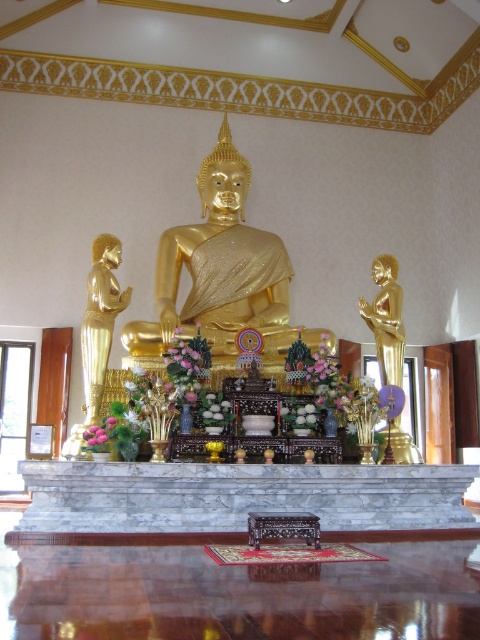
Question: Which of the following is the closest to the observer?

Choices:
 (A) gold polished statue at left
 (B) gold shiny statue at center

Answer: (A)

Question: Can you confirm if gold polished statue at left is positioned to the left of gold polished statue at right?

Choices:
 (A) no
 (B) yes

Answer: (B)

Question: Which object is farther from the camera taking this photo?

Choices:
 (A) gold polished statue at left
 (B) gold shiny statue at center
 (C) gold polished statue at right

Answer: (B)

Question: Can you confirm if gold polished statue at left is wider than gold polished statue at right?

Choices:
 (A) yes
 (B) no

Answer: (B)

Question: Is gold shiny statue at center wider than gold polished statue at right?

Choices:
 (A) no
 (B) yes

Answer: (B)

Question: Which of the following is the farthest from the observer?

Choices:
 (A) (108, 308)
 (B) (245, 180)

Answer: (B)